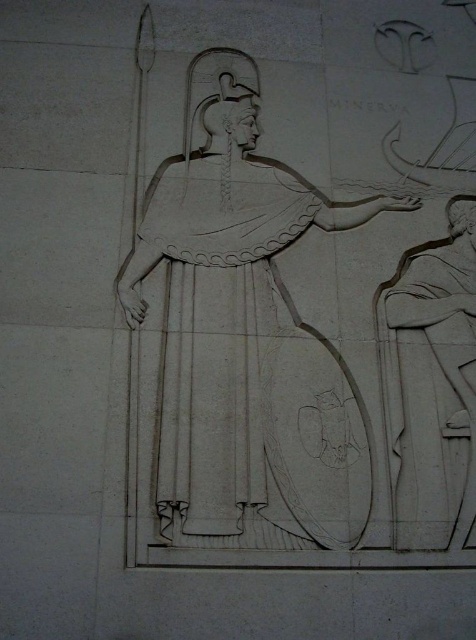
Question: Is white stone relief at center to the right of white stone figure at right from the viewer's perspective?

Choices:
 (A) no
 (B) yes

Answer: (A)

Question: Which of the following is the farthest from the observer?

Choices:
 (A) (202, 484)
 (B) (449, 385)

Answer: (B)

Question: Can you confirm if white stone relief at center is positioned to the right of white stone figure at right?

Choices:
 (A) no
 (B) yes

Answer: (A)

Question: Does white stone relief at center lie in front of white stone figure at right?

Choices:
 (A) yes
 (B) no

Answer: (A)

Question: Among these objects, which one is nearest to the camera?

Choices:
 (A) white stone relief at center
 (B) white stone figure at right

Answer: (A)